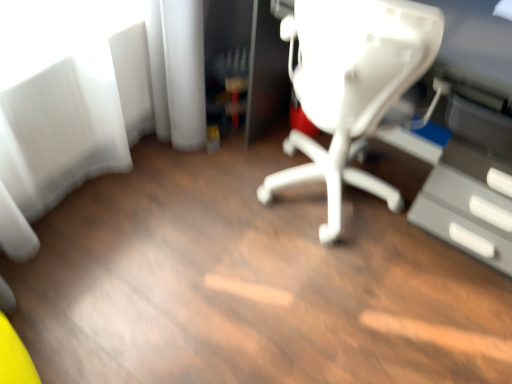
What do you see at coordinates (351, 86) in the screenshot? I see `white plastic chair at center` at bounding box center [351, 86].

Identify the location of white plastic chair at center. The height and width of the screenshot is (384, 512). point(351,86).

The width and height of the screenshot is (512, 384). I want to click on white plastic chair at center, so click(x=351, y=86).